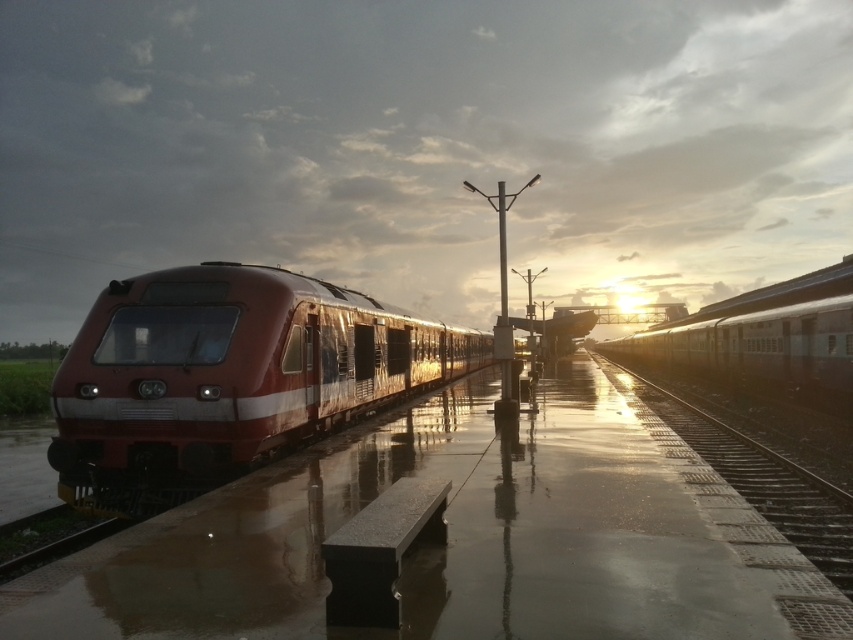
Which is below, silver metallic train at upper right or metallic train track at right?

Positioned lower is metallic train track at right.

Between point (759, 365) and point (701, 422), which one is positioned in front?

Point (701, 422)

Is point (746, 358) less distant than point (759, 449)?

No, it is behind (759, 449).

Where is `silver metallic train at upper right`? silver metallic train at upper right is located at coordinates (764, 337).

Who is lower down, metallic red train at left or silver metallic train at upper right?

Positioned lower is metallic red train at left.

Identify the location of metallic red train at left. (460, 538).

This screenshot has width=853, height=640. Identify the location of metallic red train at left. (460, 538).

Is shiny red train at left shorter than metallic train track at right?

Incorrect, shiny red train at left's height does not fall short of metallic train track at right's.

I want to click on shiny red train at left, so click(x=228, y=378).